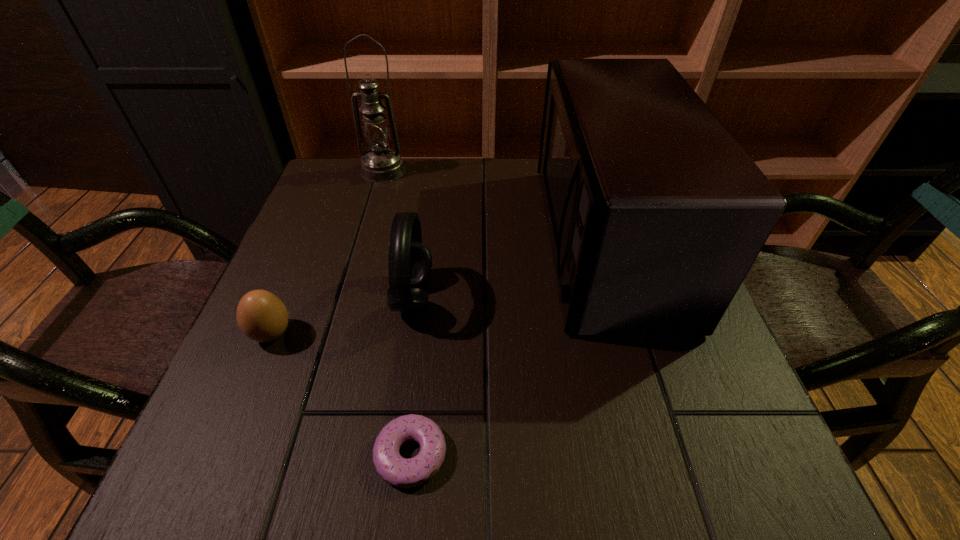
Image resolution: width=960 pixels, height=540 pixels. What are the coordinates of `vacant area situated 0.120m on the front-facing side of the rightmost object` in the screenshot? It's located at point(488,241).

Identify the location of vacant region located on the earcups of the headset. The image size is (960, 540). (532, 297).

The width and height of the screenshot is (960, 540). I want to click on free space located 0.390m on the right of the leftmost object, so click(516, 334).

Find the location of a particular element. The width and height of the screenshot is (960, 540). vacant area situated 0.100m on the right of the shortest object is located at coordinates (517, 454).

Image resolution: width=960 pixels, height=540 pixels. I want to click on oil lamp located in the far edge section of the desktop, so click(x=381, y=164).

Identify the location of microwave_oven present at the far edge. This screenshot has height=540, width=960. (656, 214).

This screenshot has width=960, height=540. I want to click on object situated at the near edge, so click(x=394, y=469).

This screenshot has width=960, height=540. What are the coordinates of `oil lamp that is at the left edge` in the screenshot? It's located at tap(381, 164).

At what (x,y) coordinates should I click in order to perform the action: click on boiled egg positioned at the left edge. Please return your answer as a coordinate pair (x, y). Image resolution: width=960 pixels, height=540 pixels. Looking at the image, I should click on (261, 316).

Find the location of a particular element. This screenshot has height=540, width=960. object that is at the right edge is located at coordinates (656, 214).